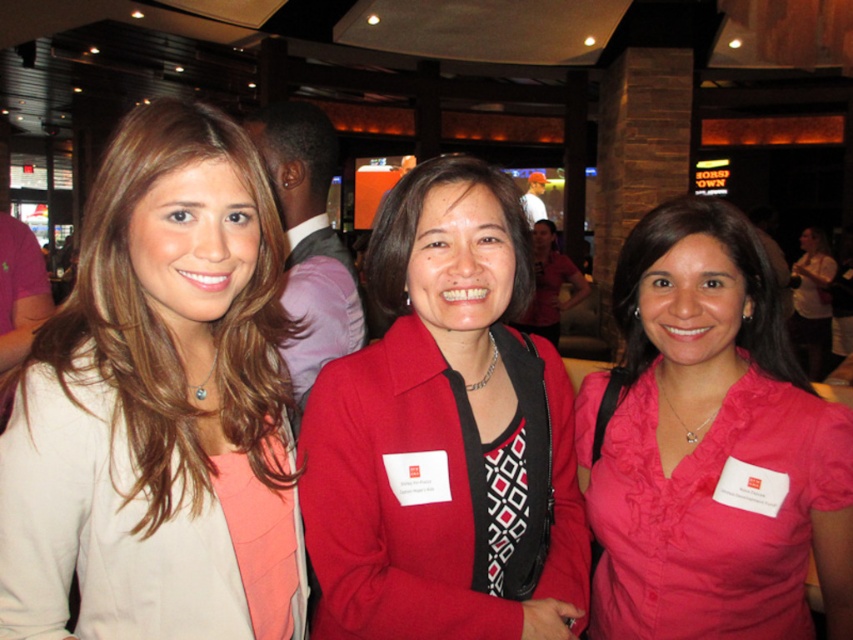
Question: Which object is positioned farthest from the pink satin blouse at center?

Choices:
 (A) pink fabric shirt at right
 (B) matte beige blazer at left

Answer: (A)

Question: Which point appears closest to the camera in this image?

Choices:
 (A) (662, 259)
 (B) (207, 506)
 (C) (814, 234)
 (D) (540, 556)

Answer: (B)

Question: Which of the following is the farthest from the observer?

Choices:
 (A) matte beige blazer at left
 (B) pink fabric shirt at right
 (C) pink satin blouse at center
 (D) matte red blazer at center

Answer: (B)

Question: Does pink satin blouse at center have a larger size compared to pink fabric shirt at right?

Choices:
 (A) yes
 (B) no

Answer: (B)

Question: Can you confirm if matte red blazer at center is smaller than pink fabric shirt at right?

Choices:
 (A) yes
 (B) no

Answer: (A)

Question: Is pink satin blouse at center below pink fabric shirt at right?

Choices:
 (A) yes
 (B) no

Answer: (A)